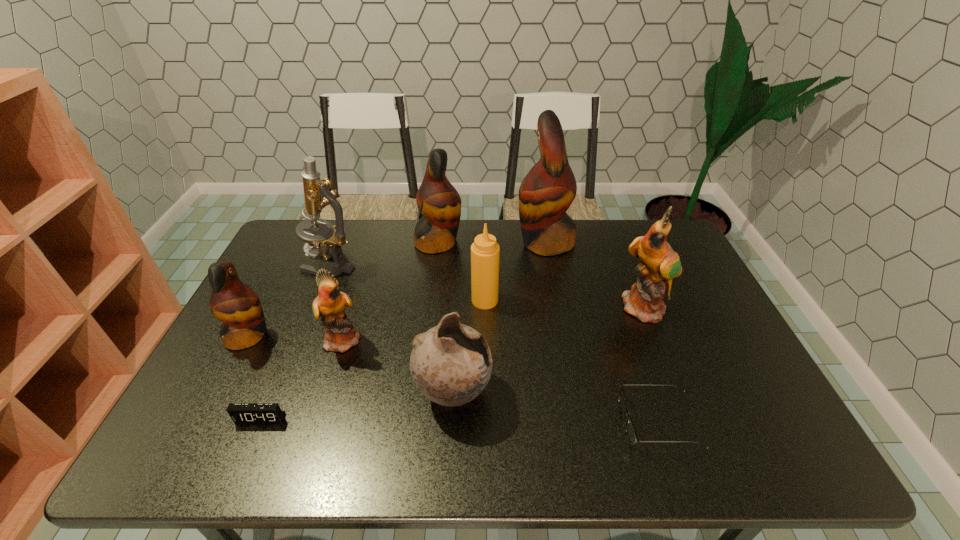
This screenshot has width=960, height=540. I want to click on the biggest red parrot, so click(547, 191).

At what (x,y) coordinates should I click in order to perform the action: click on the fourth parrot from left to right. Please return your answer as a coordinate pair (x, y). The image size is (960, 540). Looking at the image, I should click on (547, 191).

This screenshot has width=960, height=540. In order to click on microscope in this screenshot , I will do `click(317, 195)`.

The width and height of the screenshot is (960, 540). In order to click on the second smallest red parrot in this screenshot , I will do `click(439, 202)`.

I want to click on the third parrot from right to left, so click(x=439, y=202).

Where is `the right green parrot`? the right green parrot is located at coordinates (660, 264).

This screenshot has height=540, width=960. In order to click on the rightmost parrot in this screenshot , I will do `click(660, 264)`.

Locate an element on the screen. condiment is located at coordinates (485, 252).

Where is `the smaller green parrot`? the smaller green parrot is located at coordinates (340, 335).

Image resolution: width=960 pixels, height=540 pixels. In order to click on the second parrot from left to right in this screenshot , I will do `click(340, 335)`.